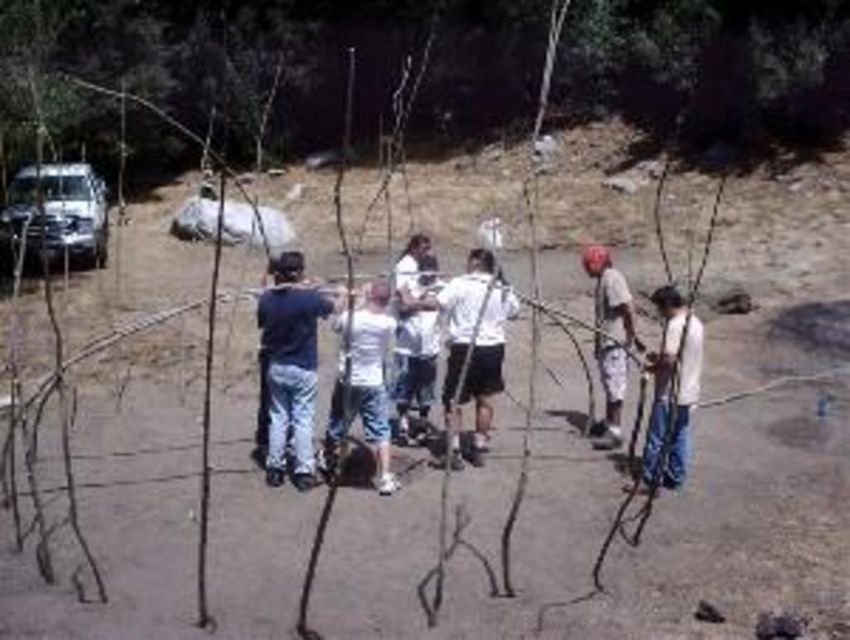
Is white matte shirt at center wider than white matte truck at upper left?

In fact, white matte shirt at center might be narrower than white matte truck at upper left.

Which is below, white matte shirt at center or white matte truck at upper left?

white matte shirt at center

The image size is (850, 640). I want to click on white matte shirt at center, so click(474, 348).

The height and width of the screenshot is (640, 850). Find the location of `white matte shirt at center`. white matte shirt at center is located at coordinates (474, 348).

Based on the photo, who is lower down, dark blue jeans at center or white matte shirt at center?

white matte shirt at center is below.

Who is more forward, (302,353) or (456,452)?

Positioned in front is point (302,353).

Locate an element on the screen. This screenshot has width=850, height=640. dark blue jeans at center is located at coordinates (290, 365).

Identify the location of dark blue jeans at center. (290, 365).

Which is below, white matte shirt at center or white cotton shirt at center-right?

white matte shirt at center

Can you confirm if white matte shirt at center is wider than white cotton shirt at center-right?

Indeed, white matte shirt at center has a greater width compared to white cotton shirt at center-right.

I want to click on white matte shirt at center, so click(x=474, y=348).

This screenshot has width=850, height=640. Find the location of `white matte shirt at center`. white matte shirt at center is located at coordinates (474, 348).